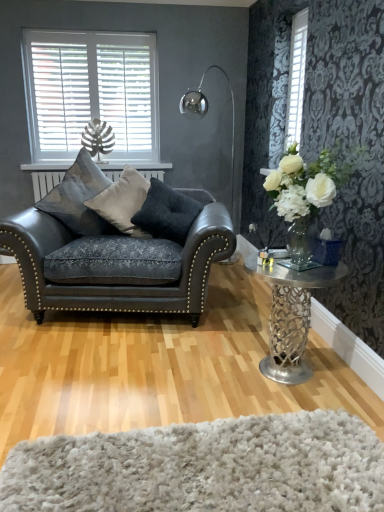
Question: Does matte black leather couch at left come behind dark gray fabric pillow at center, the first pillow in the right-to-left sequence?

Choices:
 (A) yes
 (B) no

Answer: (B)

Question: Is dark gray fabric pillow at center, the first pillow in the right-to-left sequence, located within matte black leather couch at left?

Choices:
 (A) no
 (B) yes

Answer: (B)

Question: From the image's perspective, is matte black leather couch at left on dark gray fabric pillow at center, which is the third pillow from left to right?

Choices:
 (A) no
 (B) yes

Answer: (A)

Question: Considering the relative sizes of matte black leather couch at left and dark gray fabric pillow at center, the first pillow in the right-to-left sequence, in the image provided, is matte black leather couch at left thinner than dark gray fabric pillow at center, the first pillow in the right-to-left sequence,?

Choices:
 (A) yes
 (B) no

Answer: (B)

Question: From the image's perspective, would you say matte black leather couch at left is shown under dark gray fabric pillow at center, which is the third pillow from left to right?

Choices:
 (A) yes
 (B) no

Answer: (A)

Question: Is matte black leather couch at left next to dark gray fabric pillow at center, the first pillow in the right-to-left sequence, and touching it?

Choices:
 (A) yes
 (B) no

Answer: (B)

Question: Can you confirm if satin blue cushion at left, arranged as the first pillow when viewed from the left, is positioned to the right of dark gray fabric pillow at center, the first pillow in the right-to-left sequence?

Choices:
 (A) no
 (B) yes

Answer: (A)

Question: Would you say satin blue cushion at left, marked as the third pillow in a right-to-left arrangement, is a long distance from dark gray fabric pillow at center, the first pillow in the right-to-left sequence?

Choices:
 (A) no
 (B) yes

Answer: (A)

Question: From the image's perspective, would you say satin blue cushion at left, arranged as the first pillow when viewed from the left, is positioned over dark gray fabric pillow at center, the first pillow in the right-to-left sequence?

Choices:
 (A) no
 (B) yes

Answer: (B)

Question: From a real-world perspective, is satin blue cushion at left, marked as the third pillow in a right-to-left arrangement, located beneath dark gray fabric pillow at center, the first pillow in the right-to-left sequence?

Choices:
 (A) no
 (B) yes

Answer: (A)

Question: Is satin blue cushion at left, marked as the third pillow in a right-to-left arrangement, not within dark gray fabric pillow at center, which is the third pillow from left to right?

Choices:
 (A) no
 (B) yes

Answer: (B)

Question: Considering the relative positions of satin blue cushion at left, arranged as the first pillow when viewed from the left, and dark gray fabric pillow at center, which is the third pillow from left to right, in the image provided, is satin blue cushion at left, arranged as the first pillow when viewed from the left, in front of dark gray fabric pillow at center, which is the third pillow from left to right,?

Choices:
 (A) yes
 (B) no

Answer: (B)

Question: From the image's perspective, is white textured blinds at upper right, which is counted as the 1th window, starting from the front, on polished metal floor lamp at upper center?

Choices:
 (A) yes
 (B) no

Answer: (A)